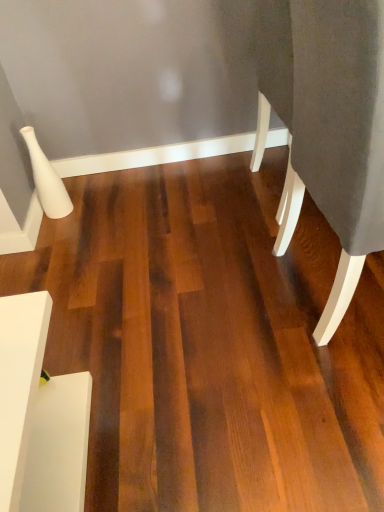
Locate an element on the screen. Image resolution: width=384 pixels, height=512 pixels. dark gray fabric at right, marked as the first furniture in a top-to-bottom arrangement is located at coordinates (327, 126).

Image resolution: width=384 pixels, height=512 pixels. What do you see at coordinates (327, 126) in the screenshot?
I see `dark gray fabric at right, the 2th furniture from the bottom` at bounding box center [327, 126].

Describe the element at coordinates (39, 416) in the screenshot. The image size is (384, 512). I see `white matte side table at lower left, the second furniture positioned from the top` at that location.

Find the location of `white matte side table at lower left, the second furniture positioned from the top`. white matte side table at lower left, the second furniture positioned from the top is located at coordinates (39, 416).

In order to face white matte side table at lower left, the second furniture positioned from the top, should I rotate leftwards or rightwards?

Turn left approximately 23.902 degrees to face it.

Find the location of a particular element. The image size is (384, 512). dark gray fabric at right, marked as the first furniture in a top-to-bottom arrangement is located at coordinates (327, 126).

Which is more to the right, white matte side table at lower left, marked as the first furniture in a left-to-right arrangement, or dark gray fabric at right, the 2th furniture from the bottom?

From the viewer's perspective, dark gray fabric at right, the 2th furniture from the bottom, appears more on the right side.

Is white matte side table at lower left, the second furniture positioned from the top, in front of or behind dark gray fabric at right, the 2th furniture from the bottom, in the image?

white matte side table at lower left, the second furniture positioned from the top, is behind dark gray fabric at right, the 2th furniture from the bottom.

Is point (77, 511) less distant than point (326, 320)?

That is True.

From the image's perspective, relative to dark gray fabric at right, which is the second furniture from left to right, is white matte side table at lower left, marked as the 1th furniture in a bottom-to-top arrangement, above or below?

Based on their image positions, white matte side table at lower left, marked as the 1th furniture in a bottom-to-top arrangement, is located beneath dark gray fabric at right, which is the second furniture from left to right.

From a real-world perspective, who is located higher, white matte side table at lower left, the second furniture positioned from the top, or dark gray fabric at right, which is the second furniture from left to right?

dark gray fabric at right, which is the second furniture from left to right, from a real-world perspective.

Between white matte side table at lower left, marked as the first furniture in a left-to-right arrangement, and dark gray fabric at right, marked as the first furniture in a right-to-left arrangement, which one has smaller width?

With smaller width is white matte side table at lower left, marked as the first furniture in a left-to-right arrangement.

From their relative heights in the image, would you say white matte side table at lower left, marked as the first furniture in a left-to-right arrangement, is taller or shorter than dark gray fabric at right, marked as the first furniture in a top-to-bottom arrangement?

Clearly, white matte side table at lower left, marked as the first furniture in a left-to-right arrangement, is shorter compared to dark gray fabric at right, marked as the first furniture in a top-to-bottom arrangement.

Consider the image. In terms of size, does white matte side table at lower left, which is the 2th furniture in right-to-left order, appear bigger or smaller than dark gray fabric at right, the 2th furniture from the bottom?

Considering their sizes, white matte side table at lower left, which is the 2th furniture in right-to-left order, takes up less space than dark gray fabric at right, the 2th furniture from the bottom.

Is dark gray fabric at right, the 2th furniture from the bottom, a part of white matte side table at lower left, marked as the first furniture in a left-to-right arrangement?

Definitely not — dark gray fabric at right, the 2th furniture from the bottom, is not inside white matte side table at lower left, marked as the first furniture in a left-to-right arrangement.

Are white matte side table at lower left, marked as the first furniture in a left-to-right arrangement, and dark gray fabric at right, marked as the first furniture in a top-to-bottom arrangement, beside each other?

There is a gap between white matte side table at lower left, marked as the first furniture in a left-to-right arrangement, and dark gray fabric at right, marked as the first furniture in a top-to-bottom arrangement.

Could you tell me if white matte side table at lower left, marked as the first furniture in a left-to-right arrangement, is turned towards dark gray fabric at right, marked as the first furniture in a right-to-left arrangement?

Yes.

How far apart are white matte side table at lower left, the second furniture positioned from the top, and dark gray fabric at right, marked as the first furniture in a right-to-left arrangement?

A distance of 86.95 centimeters exists between white matte side table at lower left, the second furniture positioned from the top, and dark gray fabric at right, marked as the first furniture in a right-to-left arrangement.

The height and width of the screenshot is (512, 384). Identify the location of furniture located in front of the white matte side table at lower left, the second furniture positioned from the top. (327, 126).

Is dark gray fabric at right, marked as the first furniture in a top-to-bottom arrangement, to the right of white matte side table at lower left, the second furniture positioned from the top, from the viewer's perspective?

Yes, dark gray fabric at right, marked as the first furniture in a top-to-bottom arrangement, is to the right of white matte side table at lower left, the second furniture positioned from the top.

Is the depth of dark gray fabric at right, the 2th furniture from the bottom, less than that of white matte side table at lower left, marked as the 1th furniture in a bottom-to-top arrangement?

Yes, dark gray fabric at right, the 2th furniture from the bottom, is closer to the camera.

Between point (272, 1) and point (35, 339), which one is positioned behind?

The point (272, 1) is farther.

From the image's perspective, which is below, dark gray fabric at right, marked as the first furniture in a top-to-bottom arrangement, or white matte side table at lower left, which is the 2th furniture in right-to-left order?

white matte side table at lower left, which is the 2th furniture in right-to-left order, from the image's perspective.

From a real-world perspective, who is located lower, dark gray fabric at right, the 2th furniture from the bottom, or white matte side table at lower left, the second furniture positioned from the top?

white matte side table at lower left, the second furniture positioned from the top.

Considering the sizes of objects dark gray fabric at right, marked as the first furniture in a right-to-left arrangement, and white matte side table at lower left, the second furniture positioned from the top, in the image provided, who is wider, dark gray fabric at right, marked as the first furniture in a right-to-left arrangement, or white matte side table at lower left, the second furniture positioned from the top,?

Wider between the two is dark gray fabric at right, marked as the first furniture in a right-to-left arrangement.

Which of these two, dark gray fabric at right, marked as the first furniture in a right-to-left arrangement, or white matte side table at lower left, the second furniture positioned from the top, stands taller?

Standing taller between the two is dark gray fabric at right, marked as the first furniture in a right-to-left arrangement.

In terms of size, does dark gray fabric at right, the 2th furniture from the bottom, appear bigger or smaller than white matte side table at lower left, the second furniture positioned from the top?

Considering their sizes, dark gray fabric at right, the 2th furniture from the bottom, takes up more space than white matte side table at lower left, the second furniture positioned from the top.

Is dark gray fabric at right, which is the second furniture from left to right, not inside white matte side table at lower left, marked as the first furniture in a left-to-right arrangement?

dark gray fabric at right, which is the second furniture from left to right, is positioned outside white matte side table at lower left, marked as the first furniture in a left-to-right arrangement.

Is dark gray fabric at right, the 2th furniture from the bottom, not near white matte side table at lower left, marked as the 1th furniture in a bottom-to-top arrangement?

Actually, dark gray fabric at right, the 2th furniture from the bottom, and white matte side table at lower left, marked as the 1th furniture in a bottom-to-top arrangement, are a little close together.

Does dark gray fabric at right, marked as the first furniture in a right-to-left arrangement, turn towards white matte side table at lower left, marked as the 1th furniture in a bottom-to-top arrangement?

No, dark gray fabric at right, marked as the first furniture in a right-to-left arrangement, is not facing towards white matte side table at lower left, marked as the 1th furniture in a bottom-to-top arrangement.

This screenshot has height=512, width=384. Identify the location of furniture in front of the white matte side table at lower left, marked as the 1th furniture in a bottom-to-top arrangement. (327, 126).

The width and height of the screenshot is (384, 512). I want to click on furniture above the white matte side table at lower left, marked as the first furniture in a left-to-right arrangement (from a real-world perspective), so click(327, 126).

Where is `furniture on the right of white matte side table at lower left, marked as the 1th furniture in a bottom-to-top arrangement`? Image resolution: width=384 pixels, height=512 pixels. furniture on the right of white matte side table at lower left, marked as the 1th furniture in a bottom-to-top arrangement is located at coordinates (327, 126).